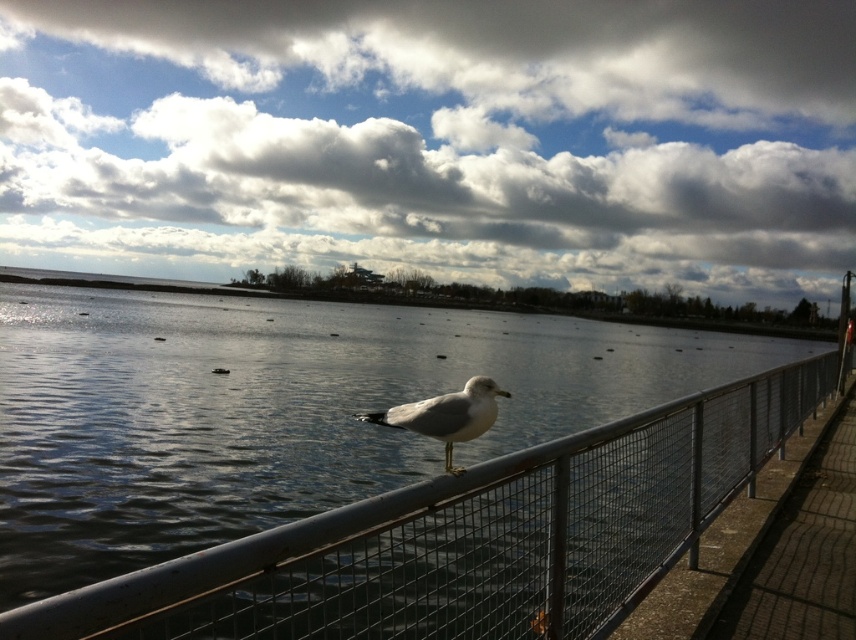
Question: Which object is the closest to the white fluffy cloud at upper center?

Choices:
 (A) white matte bird at center
 (B) metallic gray fence at center

Answer: (B)

Question: Estimate the real-world distances between objects in this image. Which object is closer to the white fluffy cloud at upper center?

Choices:
 (A) white matte bird at center
 (B) metallic gray fence at center

Answer: (B)

Question: Which object appears closest to the camera in this image?

Choices:
 (A) white fluffy cloud at upper center
 (B) white matte bird at center

Answer: (B)

Question: Observing the image, what is the correct spatial positioning of white fluffy cloud at upper center in reference to white matte bird at center?

Choices:
 (A) above
 (B) below

Answer: (A)

Question: Observing the image, what is the correct spatial positioning of white fluffy cloud at upper center in reference to white matte bird at center?

Choices:
 (A) below
 (B) above

Answer: (B)

Question: Observing the image, what is the correct spatial positioning of white fluffy cloud at upper center in reference to white matte bird at center?

Choices:
 (A) left
 (B) right

Answer: (A)